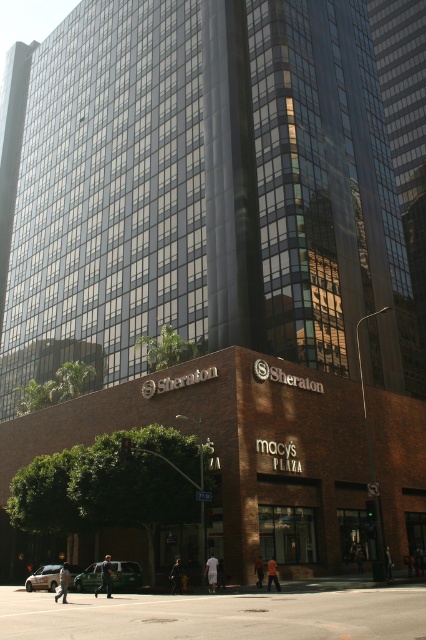
Question: Is metallic silver car at lower left below silver metallic sedan at lower left?

Choices:
 (A) yes
 (B) no

Answer: (B)

Question: Which object appears farthest from the camera in this image?

Choices:
 (A) silver metallic sedan at lower left
 (B) metallic silver car at lower left

Answer: (A)

Question: Can you confirm if metallic silver car at lower left is wider than silver metallic sedan at lower left?

Choices:
 (A) no
 (B) yes

Answer: (A)

Question: Considering the relative positions of metallic silver car at lower left and silver metallic sedan at lower left in the image provided, where is metallic silver car at lower left located with respect to silver metallic sedan at lower left?

Choices:
 (A) above
 (B) below

Answer: (A)